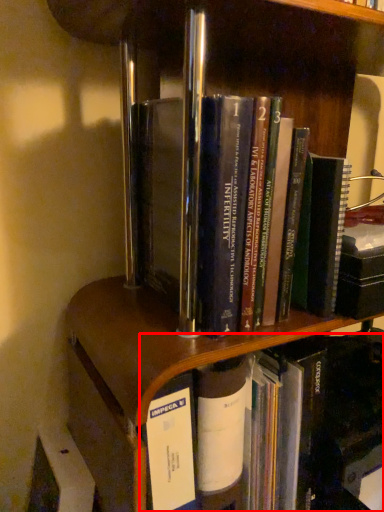
Question: From the image's perspective, where is book (annotated by the red box) located in relation to book in the image?

Choices:
 (A) below
 (B) above

Answer: (A)